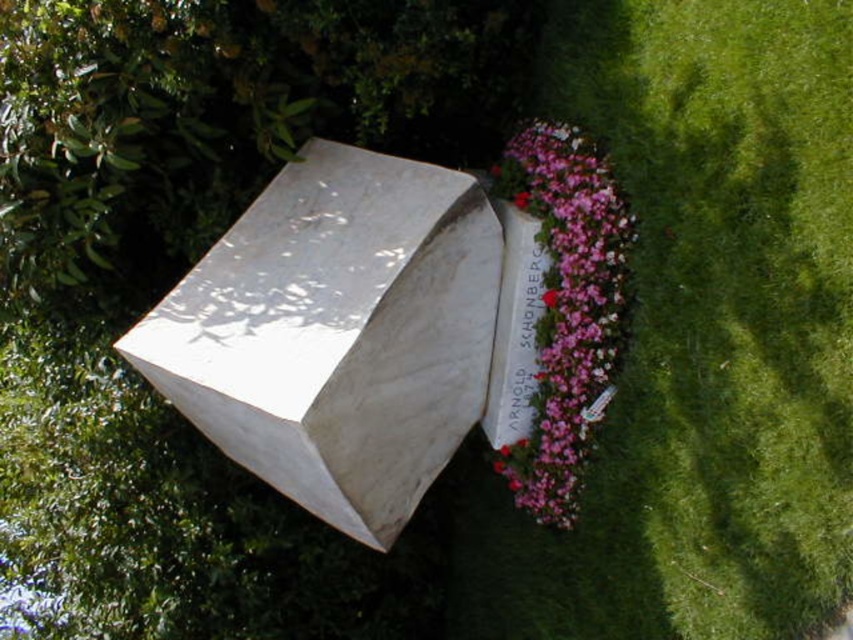
Question: Which object appears closest to the camera in this image?

Choices:
 (A) green grass at lower right
 (B) white marble box at center

Answer: (A)

Question: Is green grass at lower right smaller than pink floral bouquet at center?

Choices:
 (A) yes
 (B) no

Answer: (B)

Question: Which point is closer to the camera taking this photo?

Choices:
 (A) (596, 38)
 (B) (401, 369)
 (C) (550, 234)

Answer: (B)

Question: Is the position of white marble box at center more distant than that of pink floral bouquet at center?

Choices:
 (A) yes
 (B) no

Answer: (B)

Question: Can you confirm if white marble box at center is positioned above pink floral bouquet at center?

Choices:
 (A) no
 (B) yes

Answer: (A)

Question: Which point appears farthest from the camera in this image?

Choices:
 (A) (618, 588)
 (B) (322, 291)

Answer: (A)